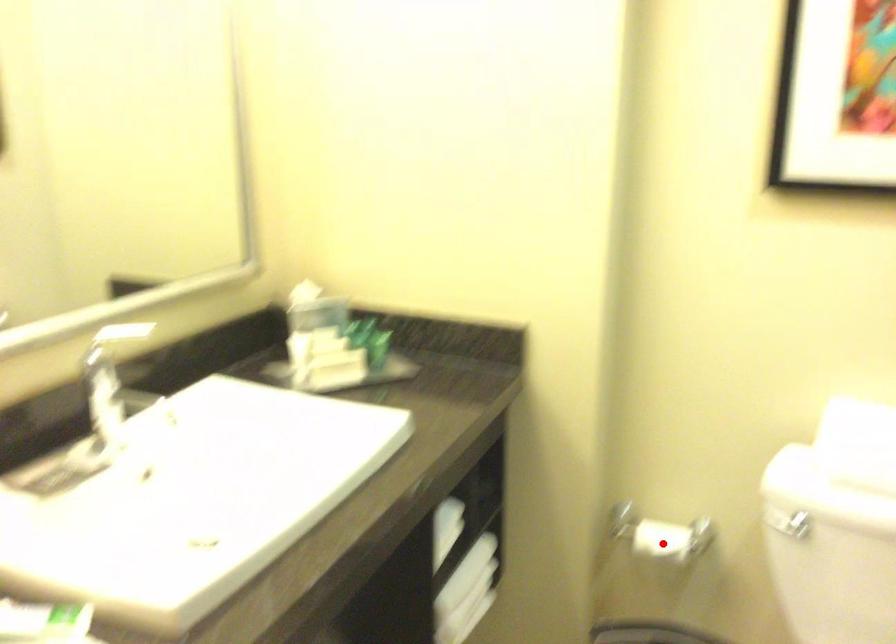
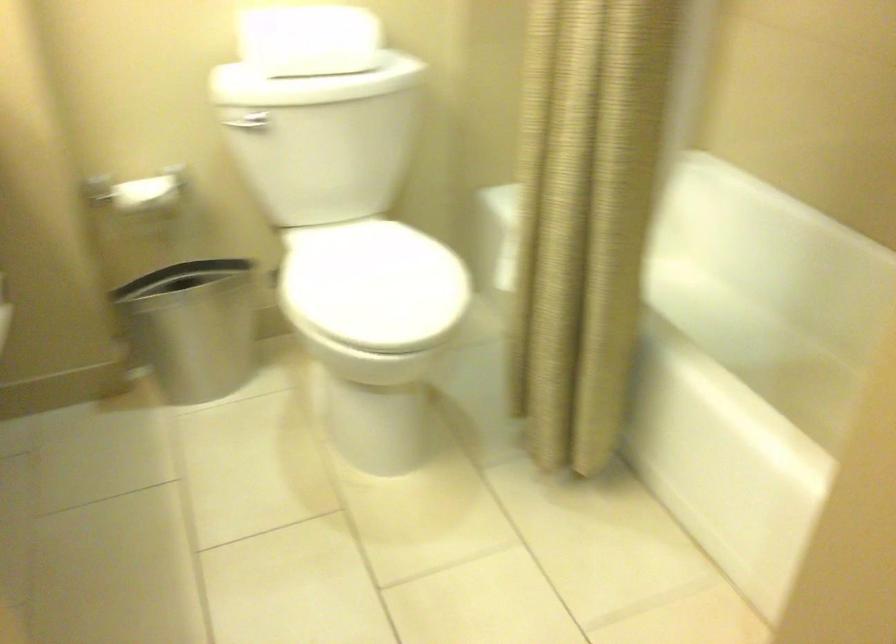
In the second image, find the point that corresponds to the highlighted location in the first image.

(147, 193)